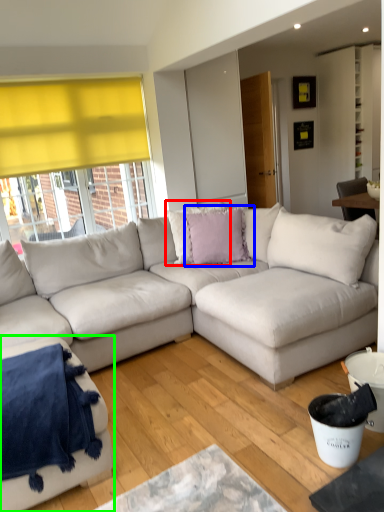
Question: Considering the real-world distances, which object is closest to pillow (highlighted by a red box)? pillow (highlighted by a blue box) or studio couch (highlighted by a green box).

Choices:
 (A) pillow
 (B) studio couch

Answer: (A)